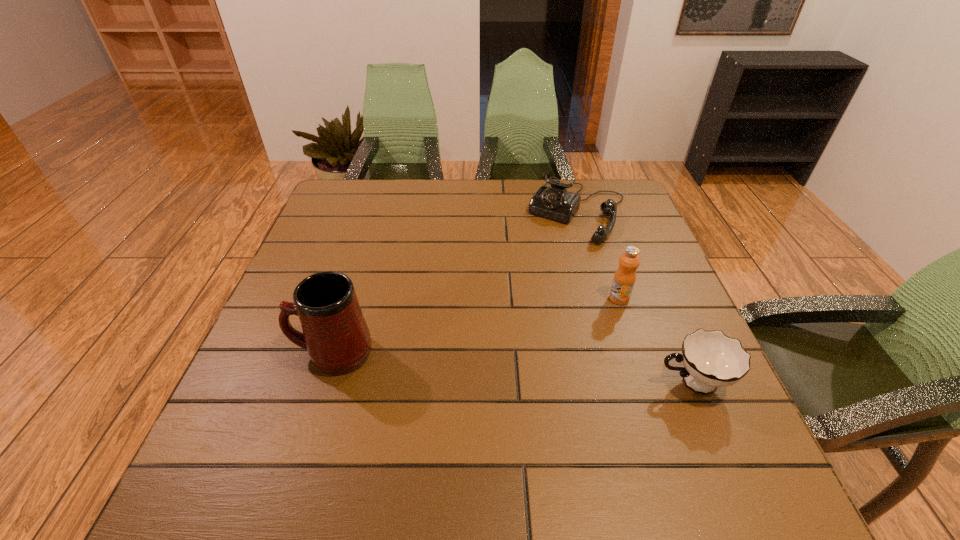
Locate an element on the screen. object situated at the left edge is located at coordinates (335, 334).

You are a GUI agent. You are given a task and a screenshot of the screen. Output one action in this format:
    pyautogui.click(x=<x>, y=<y>)
    Task: Click on the cup located at the right edge
    
    Given the screenshot: What is the action you would take?
    pyautogui.click(x=711, y=359)

You are a GUI agent. You are given a task and a screenshot of the screen. Output one action in this format:
    pyautogui.click(x=<x>, y=<y>)
    Task: Click on the orange juice that is at the right edge
    This screenshot has width=960, height=540.
    Given the screenshot: What is the action you would take?
    pyautogui.click(x=625, y=276)

Identify the location of telephone located at the right edge. Image resolution: width=960 pixels, height=540 pixels. (555, 202).

Identify the location of object at the far right corner. (555, 202).

Identify the location of object that is at the near right corner. The height and width of the screenshot is (540, 960). (711, 359).

In order to click on vacant space at the far edge of the desktop in this screenshot , I will do `click(420, 201)`.

Find the location of a particular element. vacant space at the near edge of the desktop is located at coordinates (318, 427).

You are a GUI agent. You are given a task and a screenshot of the screen. Output one action in this format:
    pyautogui.click(x=<x>, y=<y>)
    Task: Click on the free space at the left edge of the desktop
    
    Given the screenshot: What is the action you would take?
    pyautogui.click(x=304, y=369)

The width and height of the screenshot is (960, 540). I want to click on vacant space at the right edge, so click(649, 274).